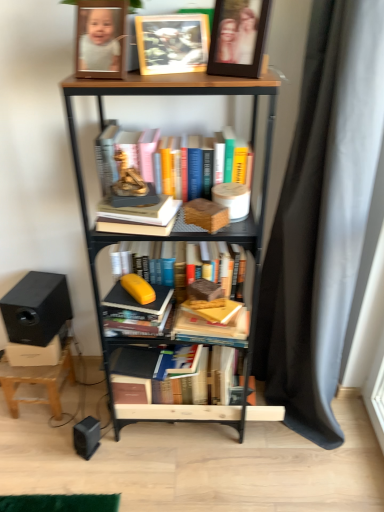
The image size is (384, 512). I want to click on vacant space that is to the left of wooden bookcase at center, so click(x=74, y=445).